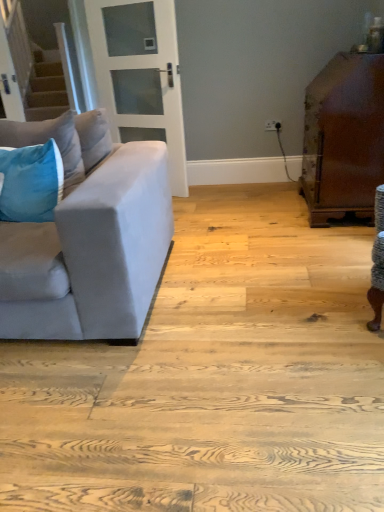
Question: Relative to velvet blue pillow at left, arranged as the first pillow when ordered from the bottom, is glossy brown wooden cabinet at right in front or behind?

Choices:
 (A) behind
 (B) front

Answer: (A)

Question: Looking at their shapes, would you say glossy brown wooden cabinet at right is wider or thinner than velvet blue pillow at left, arranged as the first pillow when ordered from the bottom?

Choices:
 (A) thin
 (B) wide

Answer: (B)

Question: Which is farther from the velvet blue pillow at left, the first pillow viewed from the top?

Choices:
 (A) glossy brown wooden cabinet at right
 (B) white glass door at upper center
 (C) velvet blue pillow at left, which is the second pillow in top-to-bottom order
 (D) suede gray couch at left

Answer: (A)

Question: Estimate the real-world distances between objects in this image. Which object is closer to the glossy brown wooden cabinet at right?

Choices:
 (A) white glass door at upper center
 (B) velvet blue pillow at left, which is the second pillow in top-to-bottom order
 (C) velvet blue pillow at left, the 2th pillow in the bottom-to-top sequence
 (D) suede gray couch at left

Answer: (D)